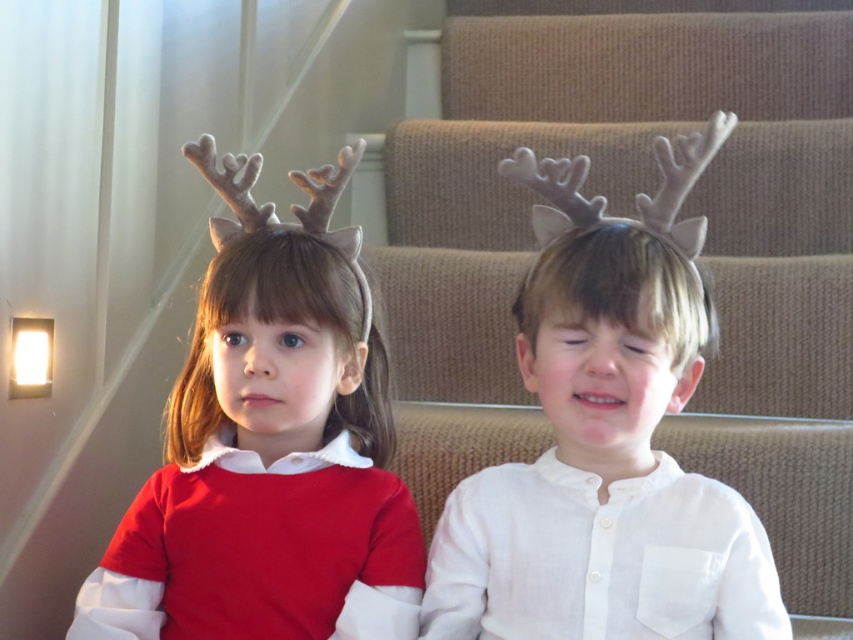
Question: Can you confirm if matte red sweater at left is positioned below white matte antlers at center?

Choices:
 (A) yes
 (B) no

Answer: (A)

Question: Can you confirm if matte red sweater at left is wider than white matte antlers at center?

Choices:
 (A) yes
 (B) no

Answer: (A)

Question: Which object is closer to the camera taking this photo?

Choices:
 (A) white matte antlers at center
 (B) matte red sweater at left

Answer: (A)

Question: Which of the following is the closest to the observer?

Choices:
 (A) (669, 179)
 (B) (283, 282)

Answer: (A)

Question: Which point is closer to the camera?

Choices:
 (A) (212, 317)
 (B) (645, 577)

Answer: (B)

Question: Is matte red sweater at left closer to camera compared to white matte antlers at center?

Choices:
 (A) yes
 (B) no

Answer: (B)